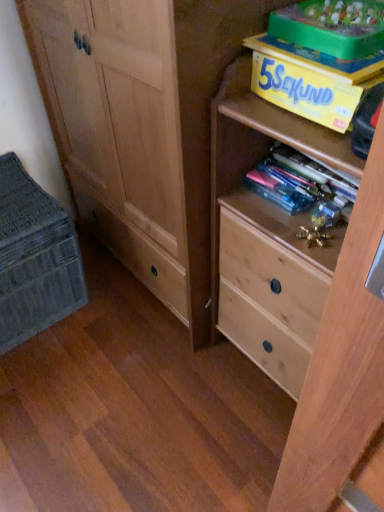
Question: From the image's perspective, is translucent plastic books at center, which is counted as the 2th book, starting from the top, above or below light wood chest of drawers at right?

Choices:
 (A) below
 (B) above

Answer: (B)

Question: Is translucent plastic books at center, placed as the 1th book when sorted from bottom to top, inside the boundaries of light wood chest of drawers at right, or outside?

Choices:
 (A) outside
 (B) inside

Answer: (B)

Question: Based on their relative distances, which object is farther from the woven fabric basket at lower left?

Choices:
 (A) green plastic storage box at upper right
 (B) translucent plastic books at center, placed as the 1th book when sorted from bottom to top
 (C) light wood chest of drawers at right
 (D) yellow cardboard box at upper right, acting as the first book starting from the top

Answer: (A)

Question: Considering the real-world distances, which object is farthest from the yellow cardboard box at upper right, acting as the first book starting from the top?

Choices:
 (A) woven fabric basket at lower left
 (B) green plastic storage box at upper right
 (C) translucent plastic books at center, placed as the 1th book when sorted from bottom to top
 (D) light wood chest of drawers at right

Answer: (A)